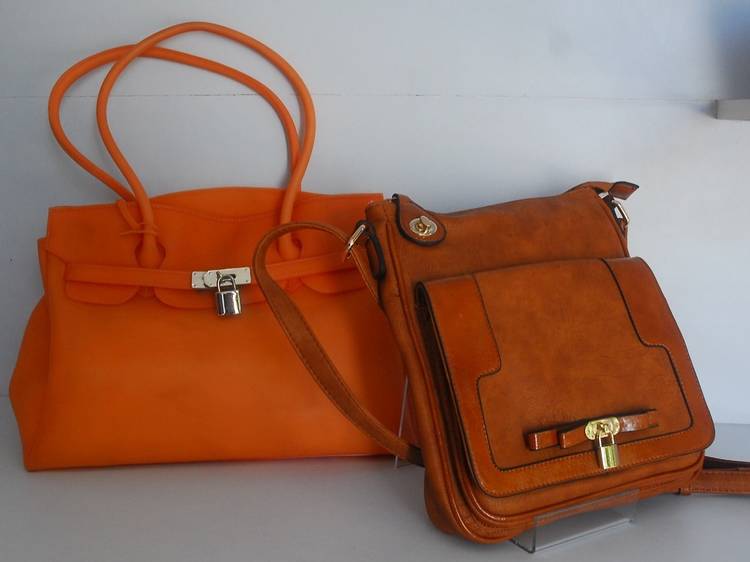
Locate an element on the screen. This screenshot has height=562, width=750. glossy tan leather is located at coordinates (x=472, y=336).